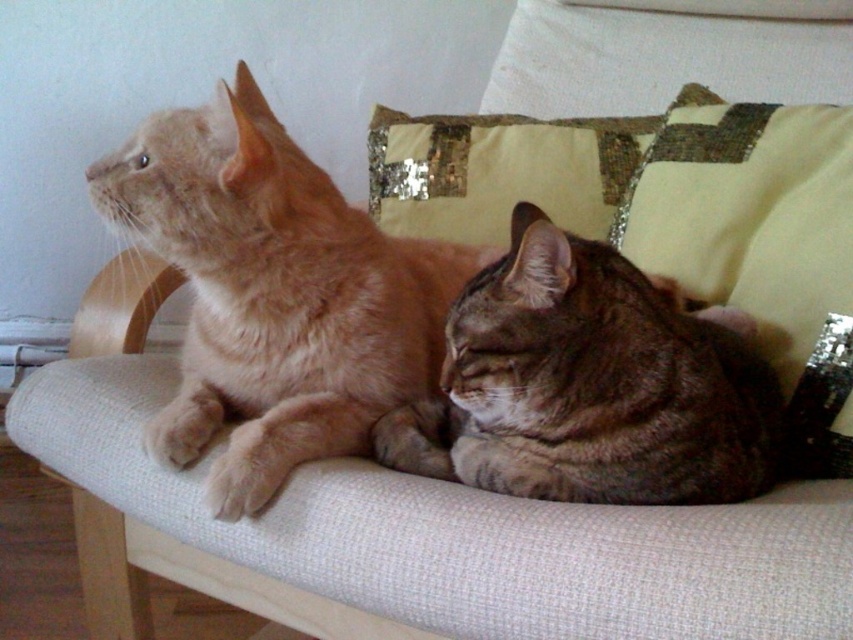
You are a photographer trying to capture both the light brown fur cat at left and the tabby fur cat at center in a single frame. Since you want to ensure both cats are visible, which cat should you focus on first to account for their sizes?

You should focus on the light brown fur cat at left first because it is larger than the tabby fur cat at center, allowing you to adjust the framing to include both effectively.

You are a cat owner who wants to place a small toy between the light brown fur cat at left and the tabby fur cat at center. The toy is 8 inches long. Will it fit between them without touching either cat?

The light brown fur cat at left and tabby fur cat at center are 9.63 inches apart from each other. Since the toy is 8 inches long, it will fit between them without touching either cat because 8 inches is less than 9.63 inches.